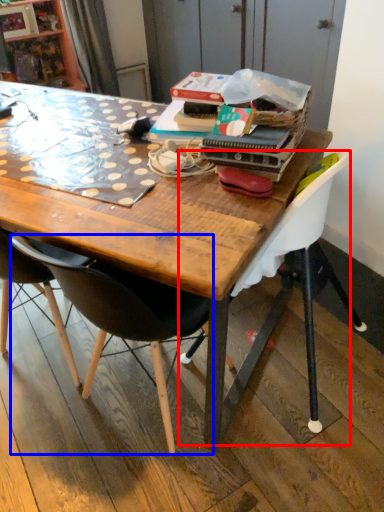
Question: Which point is closer to the camera, chair (highlighted by a red box) or chair (highlighted by a blue box)?

Choices:
 (A) chair
 (B) chair

Answer: (B)